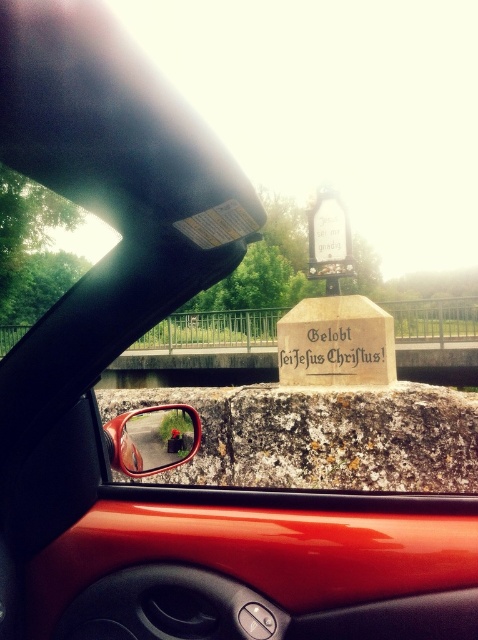
You are inside a red car and want to take a photo of the gold metallic stone at center. Where should you position your camera to capture it in the frame?

The gold metallic stone at center is located at the coordinates 0.544 on the x axis and 0.703 on the y axis, so position the camera so that the center of the frame aligns with those coordinates to capture it.

You are driving a car and looking through the windshield. You see the gold metallic stone at center and the glossy plastic rearview mirror at lower left. Which object is higher in your field of view?

The gold metallic stone at center is above the glossy plastic rearview mirror at lower left, so it is higher in your field of view.

You are driving a car and see the gold metallic stone at center and the glossy plastic rearview mirror at lower left. Which object is smaller in size?

The gold metallic stone at center is smaller than the glossy plastic rearview mirror at lower left.